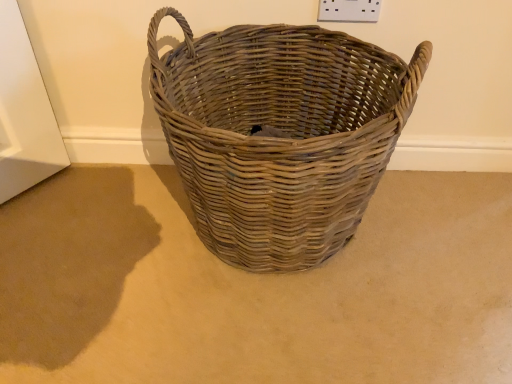
What is the approximate width of natural wicker basket at center?

natural wicker basket at center is 5.44 feet wide.

The height and width of the screenshot is (384, 512). I want to click on natural wicker basket at center, so click(253, 288).

What do you see at coordinates (253, 288) in the screenshot? Image resolution: width=512 pixels, height=384 pixels. I see `natural wicker basket at center` at bounding box center [253, 288].

Where is `natural woven basket at center`? natural woven basket at center is located at coordinates (280, 139).

The height and width of the screenshot is (384, 512). What do you see at coordinates (280, 139) in the screenshot?
I see `natural woven basket at center` at bounding box center [280, 139].

Where is `natural wicker basket at center`? The width and height of the screenshot is (512, 384). natural wicker basket at center is located at coordinates (253, 288).

Based on the photo, can you confirm if natural woven basket at center is positioned to the left of natural wicker basket at center?

No.

In the image, is natural woven basket at center positioned in front of or behind natural wicker basket at center?

natural woven basket at center is positioned closer to the viewer than natural wicker basket at center.

Does point (213, 38) appear closer or farther from the camera than point (252, 328)?

Point (213, 38) is farther from the camera than point (252, 328).

From the image's perspective, is natural woven basket at center above or below natural wicker basket at center?

From the image's perspective, natural woven basket at center appears above natural wicker basket at center.

From a real-world perspective, who is located higher, natural woven basket at center or natural wicker basket at center?

natural woven basket at center, from a real-world perspective.

Which object is thinner, natural woven basket at center or natural wicker basket at center?

Thinner between the two is natural woven basket at center.

In terms of height, does natural woven basket at center look taller or shorter compared to natural wicker basket at center?

Clearly, natural woven basket at center is taller compared to natural wicker basket at center.

Between natural woven basket at center and natural wicker basket at center, which one has smaller size?

natural wicker basket at center.

Do you think natural woven basket at center is within natural wicker basket at center, or outside of it?

natural woven basket at center is not inside natural wicker basket at center, it's outside.

Is natural woven basket at center far away from natural wicker basket at center?

Actually, natural woven basket at center and natural wicker basket at center are a little close together.

Does natural woven basket at center turn towards natural wicker basket at center?

No, natural woven basket at center is not oriented towards natural wicker basket at center.

How many degrees apart are the facing directions of natural woven basket at center and natural wicker basket at center?

90.3 degrees separate the facing orientations of natural woven basket at center and natural wicker basket at center.

There is a natural wicker basket at center. Where is `picnic basket above it (from a real-world perspective)`? The width and height of the screenshot is (512, 384). picnic basket above it (from a real-world perspective) is located at coordinates (280, 139).

Can you confirm if natural wicker basket at center is positioned to the right of natural woven basket at center?

Incorrect, natural wicker basket at center is not on the right side of natural woven basket at center.

In the image, is natural wicker basket at center positioned in front of or behind natural woven basket at center?

In the image, natural wicker basket at center appears behind natural woven basket at center.

Which is farther from the camera, (425, 224) or (240, 114)?

The point (240, 114) is farther.

From the image's perspective, is natural wicker basket at center under natural woven basket at center?

Yes, from the image's perspective, natural wicker basket at center is below natural woven basket at center.

From a real-world perspective, is natural wicker basket at center on natural woven basket at center?

Incorrect, from a real-world perspective, natural wicker basket at center is lower than natural woven basket at center.

From the picture: Considering the relative sizes of natural wicker basket at center and natural woven basket at center in the image provided, is natural wicker basket at center wider than natural woven basket at center?

Yes.

Considering the sizes of objects natural wicker basket at center and natural woven basket at center in the image provided, who is taller, natural wicker basket at center or natural woven basket at center?

With more height is natural woven basket at center.

In the scene shown: Which of these two, natural wicker basket at center or natural woven basket at center, is bigger?

Result: Bigger between the two is natural woven basket at center.

Is natural wicker basket at center inside or outside of natural woven basket at center?

natural wicker basket at center cannot be found inside natural woven basket at center.

Is natural wicker basket at center not close to natural woven basket at center?

natural wicker basket at center is actually quite close to natural woven basket at center.

Is natural wicker basket at center looking in the opposite direction of natural woven basket at center?

No, natural wicker basket at center's orientation is not away from natural woven basket at center.

Can you tell me how much natural wicker basket at center and natural woven basket at center differ in facing direction?

The facing directions of natural wicker basket at center and natural woven basket at center are 90.3 degrees apart.

I want to click on plain below the natural woven basket at center (from a real-world perspective), so click(253, 288).

Where is `plain below the natural woven basket at center (from a real-world perspective)`? This screenshot has width=512, height=384. plain below the natural woven basket at center (from a real-world perspective) is located at coordinates (253, 288).

There is a natural wicker basket at center. Identify the location of picnic basket above it (from a real-world perspective). (280, 139).